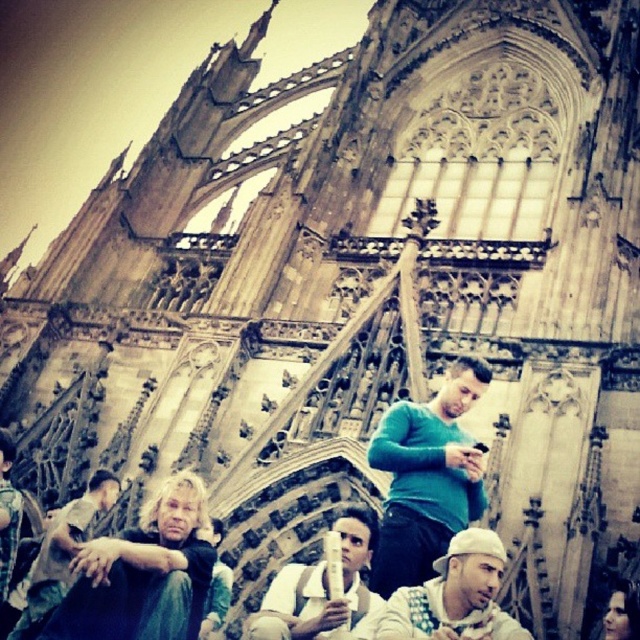
Question: Estimate the real-world distances between objects in this image. Which object is closer to the blonde hair man at lower left?

Choices:
 (A) white fabric shirt at center
 (B) white matte hat at center

Answer: (A)

Question: From the image, what is the correct spatial relationship of green matte sweater at center in relation to white matte hat at center?

Choices:
 (A) above
 (B) below

Answer: (A)

Question: Where is white matte hat at center located in relation to white fabric shirt at center in the image?

Choices:
 (A) below
 (B) above

Answer: (B)

Question: Which point is closer to the camera?

Choices:
 (A) (438, 596)
 (B) (316, 637)

Answer: (A)

Question: Considering the relative positions of blonde hair man at lower left and white matte hat at center in the image provided, where is blonde hair man at lower left located with respect to white matte hat at center?

Choices:
 (A) left
 (B) right

Answer: (A)

Question: Which object is closer to the camera taking this photo?

Choices:
 (A) green matte sweater at center
 (B) white fabric shirt at center
 (C) blonde hair man at lower left

Answer: (B)